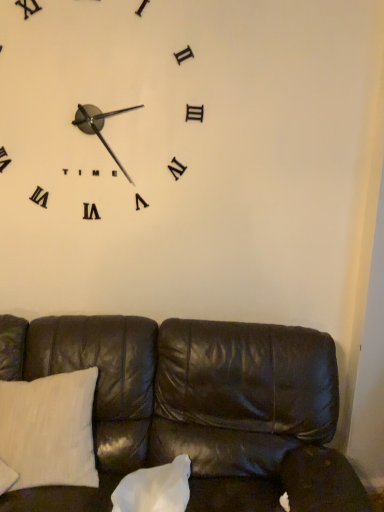
Question: From a real-world perspective, is white cotton pillow at lower left, the 2th pillow in the right-to-left sequence, below leather couch at lower center?

Choices:
 (A) yes
 (B) no

Answer: (B)

Question: Does white cotton pillow at lower left, the 2th pillow in the right-to-left sequence, turn towards leather couch at lower center?

Choices:
 (A) yes
 (B) no

Answer: (A)

Question: From the image's perspective, does white cotton pillow at lower left, the 2th pillow in the right-to-left sequence, appear higher than leather couch at lower center?

Choices:
 (A) no
 (B) yes

Answer: (B)

Question: Does white cotton pillow at lower left, the 2th pillow in the right-to-left sequence, have a greater width compared to leather couch at lower center?

Choices:
 (A) yes
 (B) no

Answer: (B)

Question: Would you say white cotton pillow at lower left, the 2th pillow in the right-to-left sequence, is outside leather couch at lower center?

Choices:
 (A) yes
 (B) no

Answer: (B)

Question: In terms of width, does leather couch at lower center look wider or thinner when compared to white cotton pillow at lower left, the 2th pillow in the right-to-left sequence?

Choices:
 (A) thin
 (B) wide

Answer: (B)

Question: Does point (248, 392) appear closer or farther from the camera than point (36, 482)?

Choices:
 (A) farther
 (B) closer

Answer: (A)

Question: In terms of height, does leather couch at lower center look taller or shorter compared to white cotton pillow at lower left, marked as the 1th pillow in a left-to-right arrangement?

Choices:
 (A) short
 (B) tall

Answer: (B)

Question: From a real-world perspective, relative to white cotton pillow at lower left, marked as the 1th pillow in a left-to-right arrangement, is leather couch at lower center vertically above or below?

Choices:
 (A) above
 (B) below

Answer: (B)

Question: Choose the correct answer: Is white cotton pillow at lower left, the 2th pillow in the right-to-left sequence, inside leather couch at lower center or outside it?

Choices:
 (A) inside
 (B) outside

Answer: (A)

Question: In terms of width, does white cotton pillow at lower left, marked as the 1th pillow in a left-to-right arrangement, look wider or thinner when compared to leather couch at lower center?

Choices:
 (A) thin
 (B) wide

Answer: (A)

Question: From a real-world perspective, relative to leather couch at lower center, is white cotton pillow at lower left, the 2th pillow in the right-to-left sequence, vertically above or below?

Choices:
 (A) below
 (B) above

Answer: (B)

Question: From the image's perspective, is white cotton pillow at lower left, the 2th pillow in the right-to-left sequence, positioned above or below leather couch at lower center?

Choices:
 (A) above
 (B) below

Answer: (A)

Question: Based on their sizes in the image, would you say white matte clock at upper left is bigger or smaller than leather couch at lower center?

Choices:
 (A) small
 (B) big

Answer: (A)

Question: From a real-world perspective, is white matte clock at upper left above or below leather couch at lower center?

Choices:
 (A) above
 (B) below

Answer: (A)